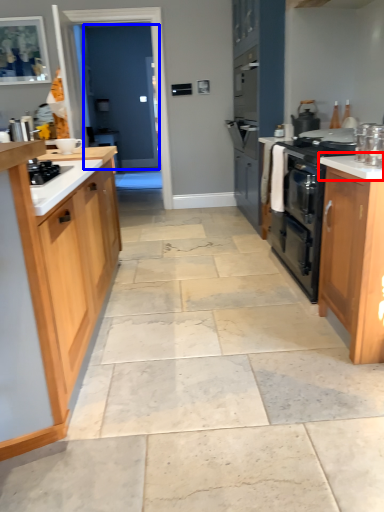
Question: Which of the following is the closest to the observer, countertop (highlighted by a red box) or glass door (highlighted by a blue box)?

Choices:
 (A) countertop
 (B) glass door

Answer: (A)